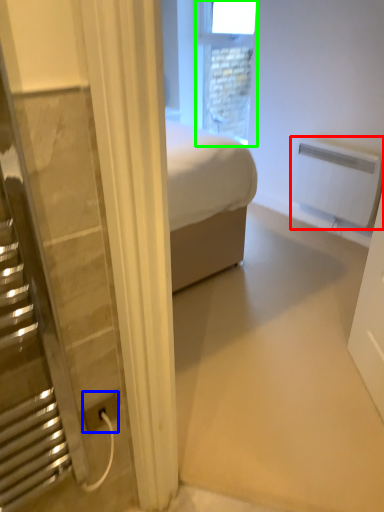
Question: Based on their relative distances, which object is farther from radiator (highlighted by a red box)? Choose from power plugs and sockets (highlighted by a blue box) and window (highlighted by a green box).

Choices:
 (A) power plugs and sockets
 (B) window

Answer: (A)